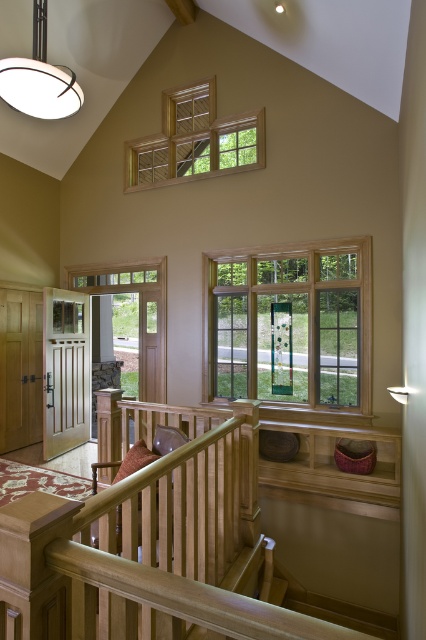
Looking at this image, between wooden rail at center and clear glass door at left, which one appears on the left side from the viewer's perspective?

clear glass door at left is more to the left.

Which is in front, point (238, 618) or point (123, 266)?

Positioned in front is point (238, 618).

Locate an element on the screen. This screenshot has height=640, width=426. wooden rail at center is located at coordinates (173, 547).

From the picture: Which is below, clear glass window at center or wooden balustrade at center?

wooden balustrade at center is below.

Is clear glass window at center smaller than wooden balustrade at center?

Incorrect, clear glass window at center is not smaller in size than wooden balustrade at center.

Does point (311, 358) come closer to viewer compared to point (382, 493)?

No, (311, 358) is further to viewer.

The height and width of the screenshot is (640, 426). Find the location of `clear glass window at center`. clear glass window at center is located at coordinates (290, 324).

Who is higher up, wooden rail at center or wooden balustrade at center?

wooden rail at center is above.

Does wooden rail at center have a lesser height compared to wooden balustrade at center?

In fact, wooden rail at center may be taller than wooden balustrade at center.

Locate an element on the screen. wooden rail at center is located at coordinates (173, 547).